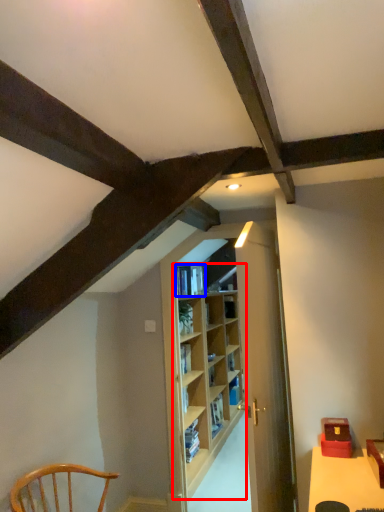
Question: Which of the following is the closest to the observer, shelf (highlighted by a red box) or book (highlighted by a blue box)?

Choices:
 (A) shelf
 (B) book

Answer: (A)